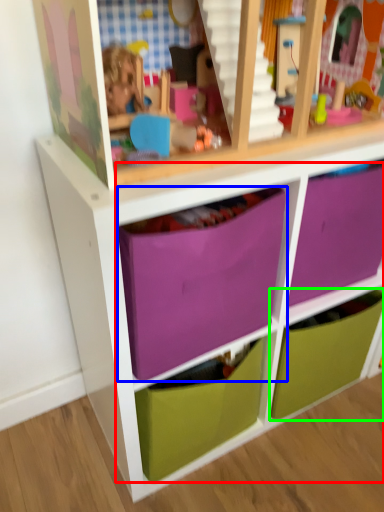
Question: Which object is the closest to the drawer (highlighted by a red box)? Choose among these: drawer (highlighted by a blue box) or drawer (highlighted by a green box).

Choices:
 (A) drawer
 (B) drawer

Answer: (A)